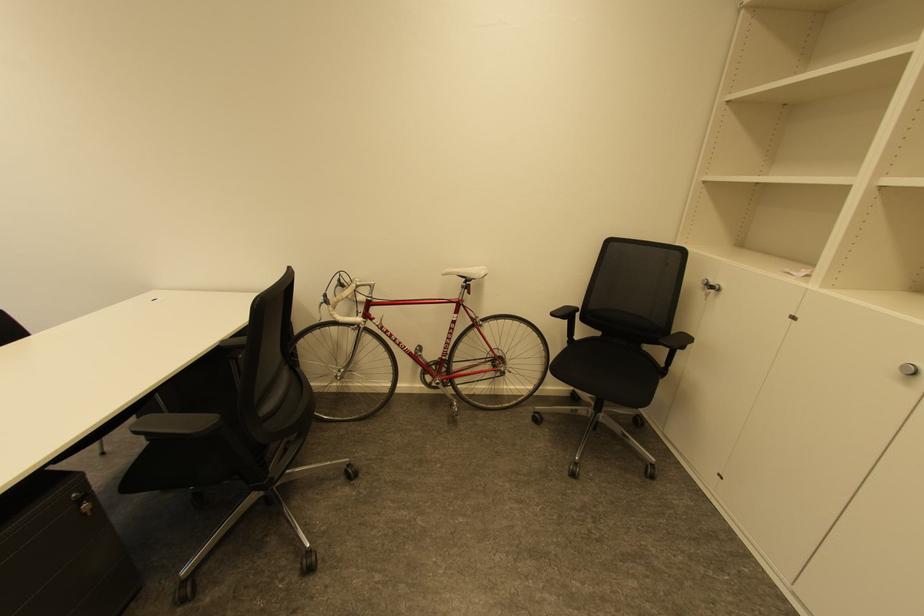
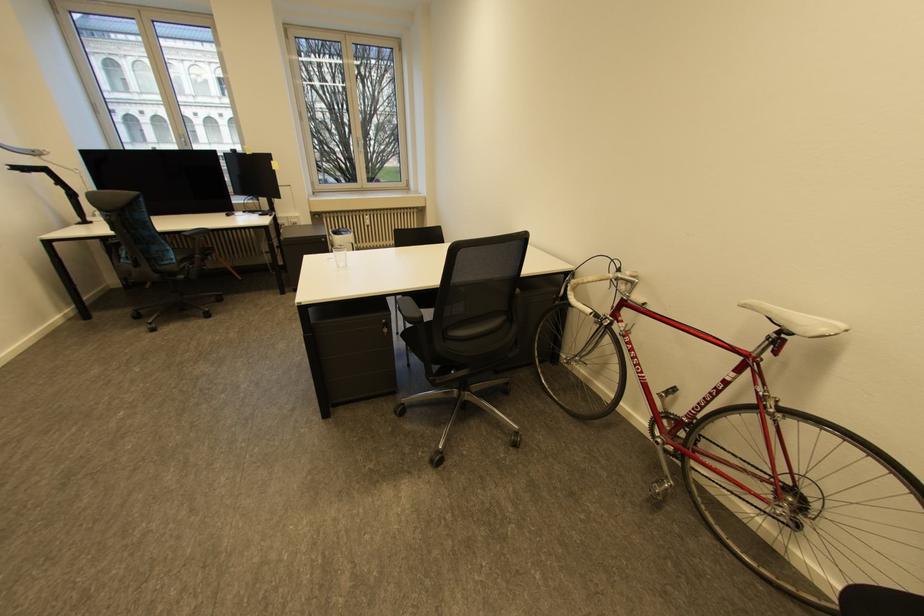
The point at (475, 281) is marked in the first image. Where is the corresponding point in the second image?

(789, 331)